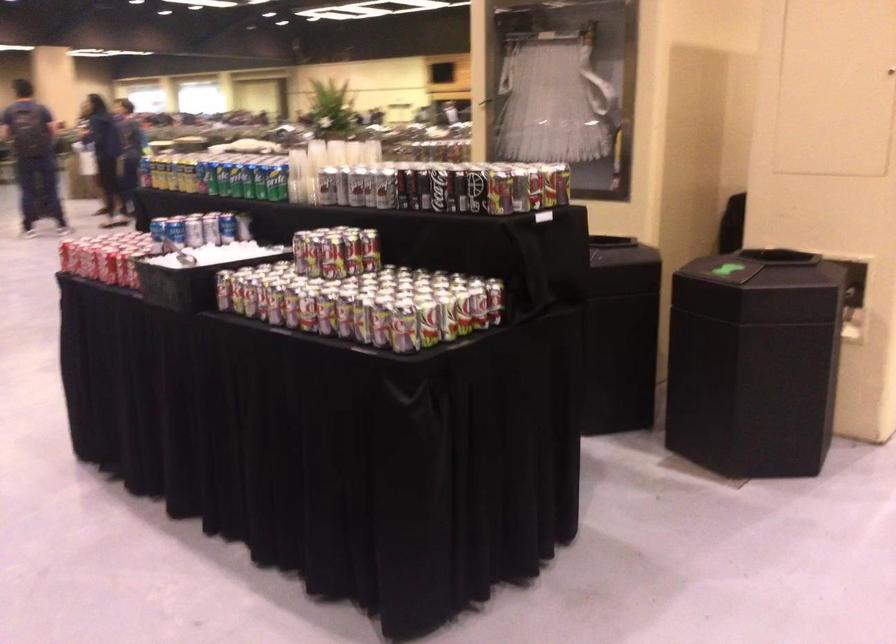
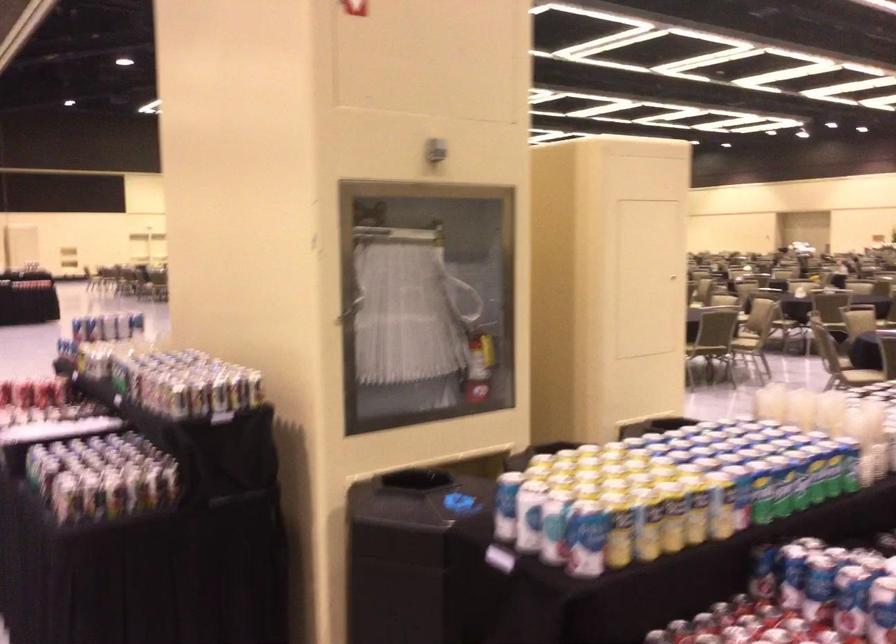
Locate, in the second image, the point that corresponds to (x=199, y=166) in the first image.

(761, 491)